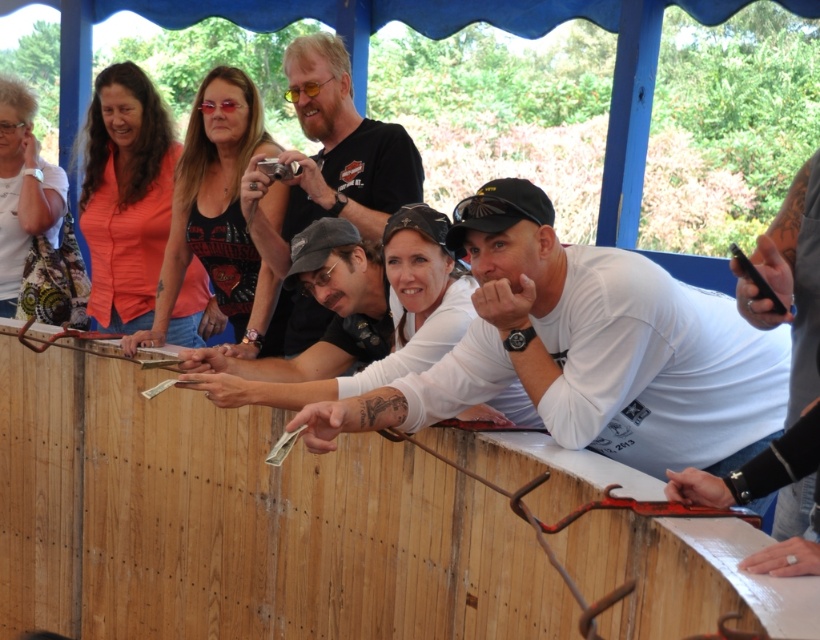
Question: Is wooden fence at center positioned at the back of black matte t-shirt at center?

Choices:
 (A) no
 (B) yes

Answer: (A)

Question: Which point appears closest to the camera in this image?

Choices:
 (A) (3, 230)
 (B) (393, 124)
 (C) (130, 400)

Answer: (C)

Question: Estimate the real-world distances between objects in this image. Which object is closer to the white printed shirt at upper left?

Choices:
 (A) wooden fence at center
 (B) black matte t-shirt at center

Answer: (A)

Question: Can you confirm if wooden fence at center is bigger than white printed shirt at upper left?

Choices:
 (A) no
 (B) yes

Answer: (B)

Question: Considering the relative positions of wooden fence at center and black matte t-shirt at center in the image provided, where is wooden fence at center located with respect to black matte t-shirt at center?

Choices:
 (A) below
 (B) above

Answer: (A)

Question: Which point is farther to the camera?

Choices:
 (A) pos(313,528)
 (B) pos(8,234)

Answer: (B)